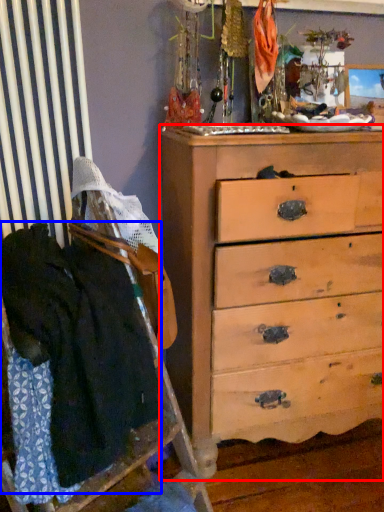
Question: Among these objects, which one is nearest to the camera, chest of drawers (highlighted by a red box) or clothing (highlighted by a blue box)?

Choices:
 (A) chest of drawers
 (B) clothing

Answer: (B)